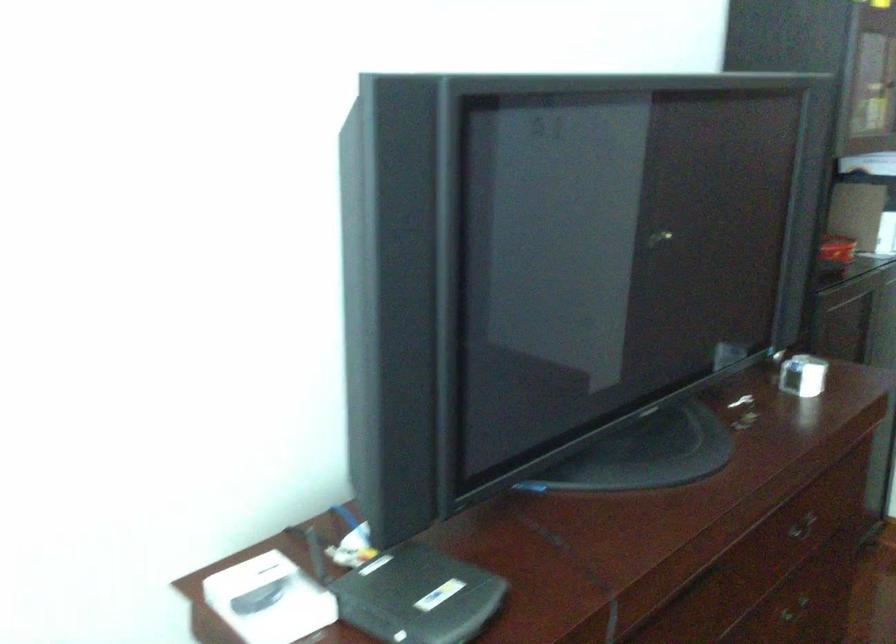
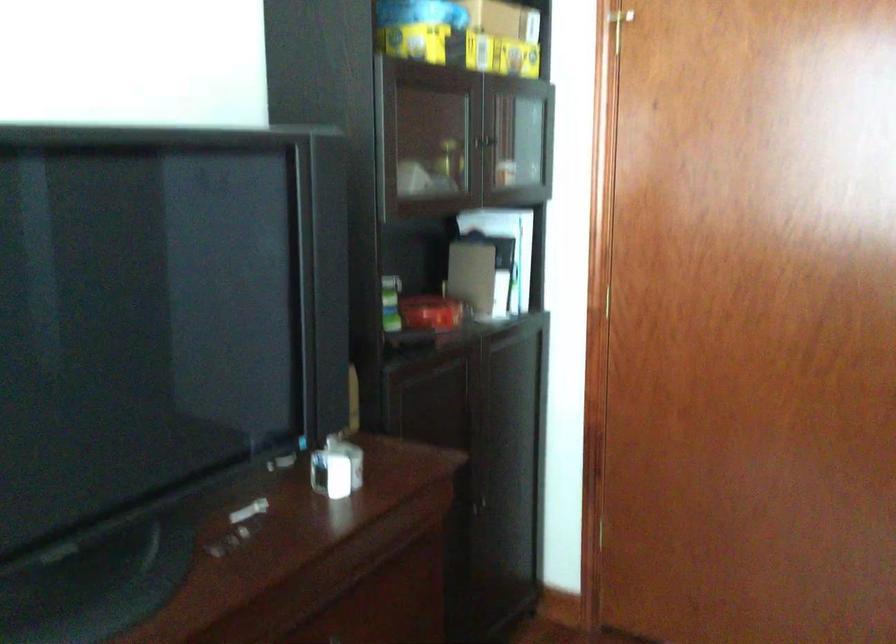
Question: The images are taken continuously from a first-person perspective. In which direction are you moving?

Choices:
 (A) Left
 (B) Right
 (C) Forward
 (D) Backward

Answer: (B)